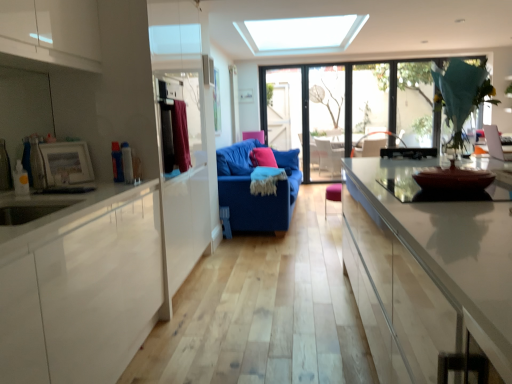
Question: In terms of width, does transparent glass window at upper right, arranged as the first window when viewed from the right, look wider or thinner when compared to transparent glass door at center?

Choices:
 (A) thin
 (B) wide

Answer: (A)

Question: Is transparent glass window at upper right, arranged as the first window when viewed from the right, spatially inside transparent glass door at center, or outside of it?

Choices:
 (A) inside
 (B) outside

Answer: (B)

Question: Based on their relative distances, which object is nearer to the velvet burgundy curtain at left?

Choices:
 (A) blue fabric couch at center
 (B) brown glossy bowl at right
 (C) pink fabric armchair at center
 (D) transparent glass door at center
 (E) transparent glass window at center, the second window when ordered from right to left

Answer: (A)

Question: Estimate the real-world distances between objects in this image. Which object is farther from the blue fabric couch at center?

Choices:
 (A) pink fabric armchair at center
 (B) blue fabric couch at center
 (C) brown glossy bowl at right
 (D) pink fabric pillow at center
 (E) transparent glass window at center, which is counted as the first window, starting from the left

Answer: (C)